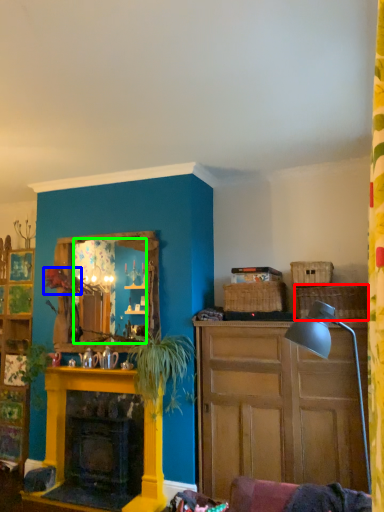
Question: Which object is the closest to the picnic basket (highlighted by a red box)? Choose among these: flower (highlighted by a blue box) or mirror (highlighted by a green box).

Choices:
 (A) flower
 (B) mirror

Answer: (B)